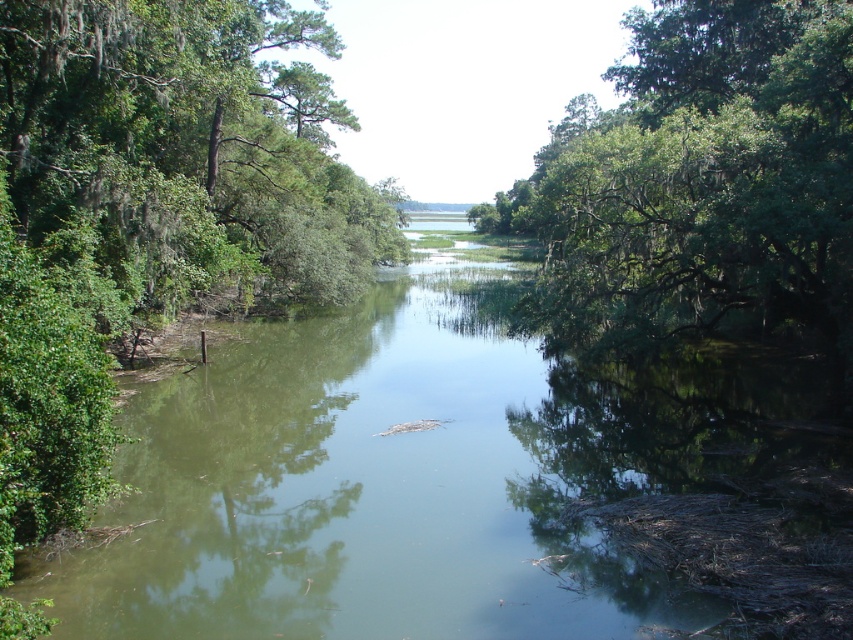
Question: Can you confirm if green reflective water at center is smaller than green leafy tree at upper right?

Choices:
 (A) yes
 (B) no

Answer: (A)

Question: Does green reflective water at center have a lesser width compared to green leafy tree at upper right?

Choices:
 (A) no
 (B) yes

Answer: (B)

Question: Which point is closer to the camera?

Choices:
 (A) green reflective water at center
 (B) green leafy tree at upper right

Answer: (A)

Question: Which object is closer to the camera taking this photo?

Choices:
 (A) green reflective water at center
 (B) green leafy tree at upper right

Answer: (A)

Question: In this image, where is green reflective water at center located relative to green leafy tree at upper right?

Choices:
 (A) below
 (B) above

Answer: (A)